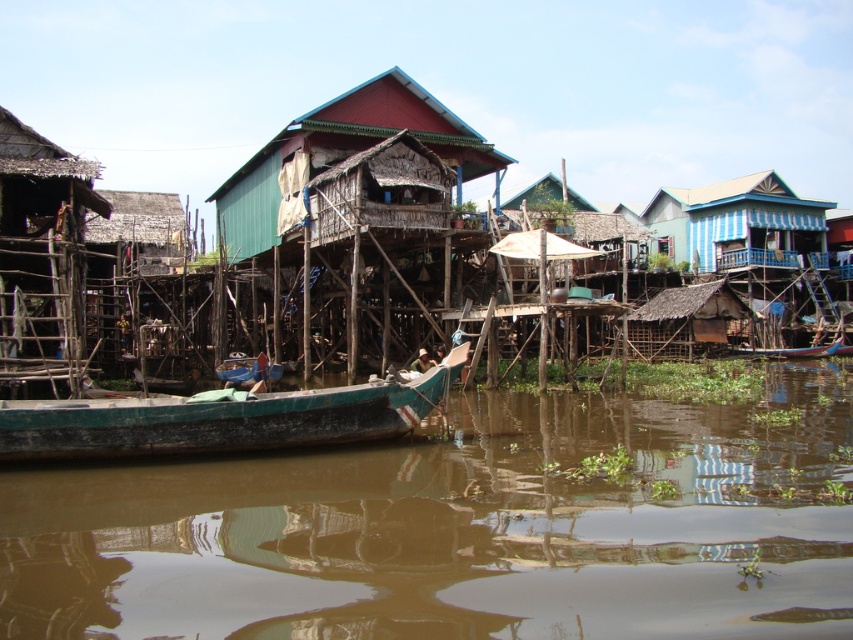
Is brown murky water at center in front of wooden boat at center?

Yes.

Does brown murky water at center have a greater height compared to wooden boat at center?

Indeed, brown murky water at center has a greater height compared to wooden boat at center.

Is point (369, 528) farther from camera compared to point (830, 352)?

That is False.

Where is `brown murky water at center`? Image resolution: width=853 pixels, height=640 pixels. brown murky water at center is located at coordinates (462, 528).

Does wooden thatched hut at center have a greater width compared to green painted wood boat at lower left?

Correct, the width of wooden thatched hut at center exceeds that of green painted wood boat at lower left.

The width and height of the screenshot is (853, 640). What do you see at coordinates (358, 193) in the screenshot?
I see `wooden thatched hut at center` at bounding box center [358, 193].

Find the location of a particular element. This screenshot has width=853, height=640. wooden thatched hut at center is located at coordinates (358, 193).

The height and width of the screenshot is (640, 853). Identify the location of wooden thatched hut at center. (358, 193).

Which is in front, point (668, 198) or point (61, 218)?

Point (61, 218)

Is point (242, 214) less distant than point (68, 230)?

No, it is behind (68, 230).

Does point (775, 305) lie in front of point (82, 192)?

No, it is behind (82, 192).

Identify the location of wooden stilt houses at center. (329, 173).